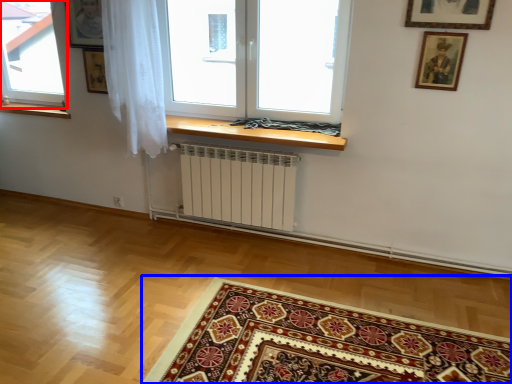
Question: Among these objects, which one is farthest to the camera, window (highlighted by a red box) or mat (highlighted by a blue box)?

Choices:
 (A) window
 (B) mat

Answer: (A)